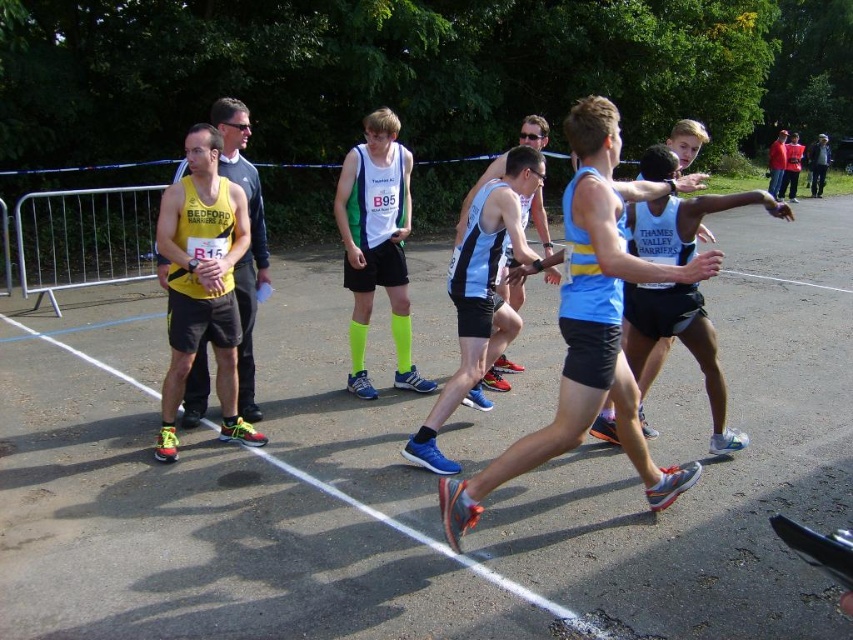
Between neon green fabric shorts at center and yellow matte tank top at left, which one has more height?

Standing taller between the two is yellow matte tank top at left.

Is neon green fabric shorts at center above yellow matte tank top at left?

Indeed, neon green fabric shorts at center is positioned over yellow matte tank top at left.

At what (x,y) coordinates should I click in order to perform the action: click on neon green fabric shorts at center. Please return your answer as a coordinate pair (x, y). This screenshot has width=853, height=640. Looking at the image, I should click on (376, 244).

This screenshot has height=640, width=853. I want to click on neon green fabric shorts at center, so click(x=376, y=244).

Does neon green fabric shorts at center have a greater height compared to light blue mesh tank top at center?

In fact, neon green fabric shorts at center may be shorter than light blue mesh tank top at center.

Is neon green fabric shorts at center above light blue mesh tank top at center?

Incorrect, neon green fabric shorts at center is not positioned above light blue mesh tank top at center.

Between point (392, 260) and point (512, 368), which one is positioned in front?

Positioned in front is point (392, 260).

Identify the location of neon green fabric shorts at center. This screenshot has width=853, height=640. (376, 244).

Is point (254, 310) behind point (775, 196)?

No, (254, 310) is in front of (775, 196).

Does yellow matte tank top at left have a lesser height compared to red jacket at upper right?

Indeed, yellow matte tank top at left has a lesser height compared to red jacket at upper right.

I want to click on yellow matte tank top at left, so click(250, 240).